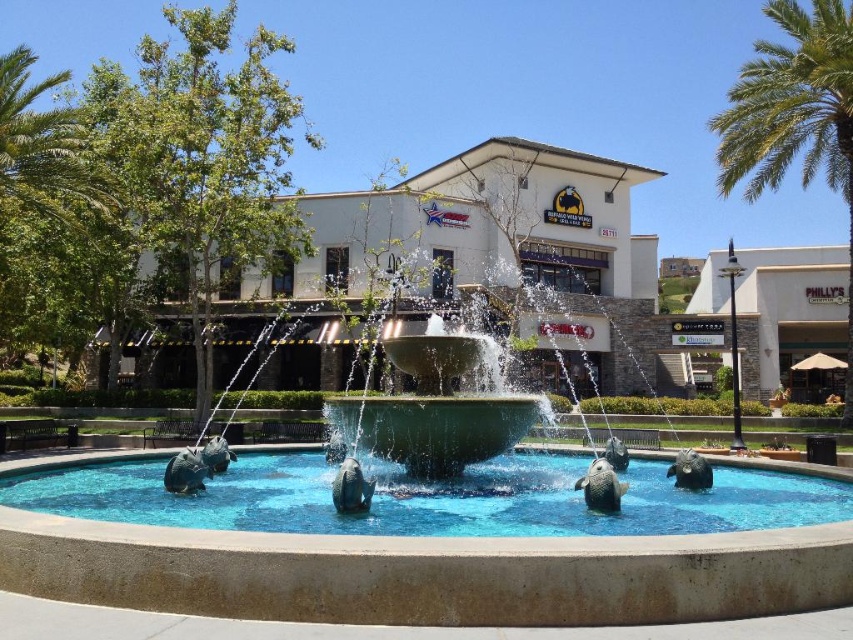
Question: Is green stone fountain at center thinner than white stucco building at center?

Choices:
 (A) no
 (B) yes

Answer: (B)

Question: In this image, where is green stone fountain at center located relative to green leafy palm tree at left?

Choices:
 (A) left
 (B) right

Answer: (B)

Question: Is green leafy palm tree at left positioned at the back of white stone building at right?

Choices:
 (A) yes
 (B) no

Answer: (B)

Question: Which object appears closest to the camera in this image?

Choices:
 (A) white stone building at right
 (B) white stucco building at center

Answer: (B)

Question: Which point appears farthest from the camera in this image?

Choices:
 (A) (758, 81)
 (B) (73, 218)
 (C) (796, 300)
 (D) (33, 570)

Answer: (C)

Question: Among these points, which one is farthest from the camera?

Choices:
 (A) (28, 164)
 (B) (851, 340)

Answer: (B)